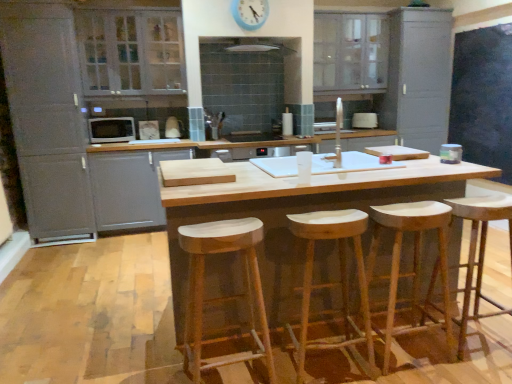
Locate an element on the screen. The height and width of the screenshot is (384, 512). vacant space underneath natural wood stool at center, arranged as the 1th stool when viewed from the right (from a real-world perspective) is located at coordinates (407, 356).